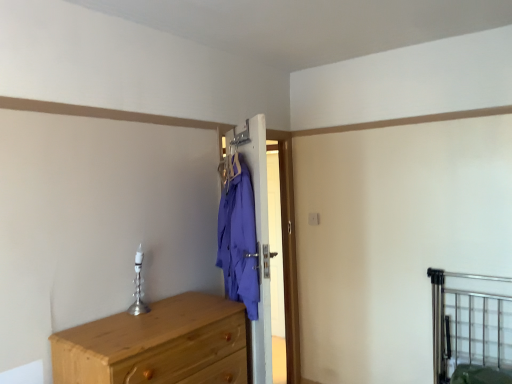
Question: Does metallic silver bed frame at lower right have a lesser width compared to light brown wooden chest of drawers at lower left?

Choices:
 (A) no
 (B) yes

Answer: (B)

Question: Can you confirm if metallic silver bed frame at lower right is taller than light brown wooden chest of drawers at lower left?

Choices:
 (A) no
 (B) yes

Answer: (B)

Question: Is metallic silver bed frame at lower right smaller than light brown wooden chest of drawers at lower left?

Choices:
 (A) yes
 (B) no

Answer: (A)

Question: From the image's perspective, is metallic silver bed frame at lower right located beneath light brown wooden chest of drawers at lower left?

Choices:
 (A) yes
 (B) no

Answer: (A)

Question: From the image's perspective, is metallic silver bed frame at lower right above light brown wooden chest of drawers at lower left?

Choices:
 (A) yes
 (B) no

Answer: (B)

Question: From a real-world perspective, is metallic silver bed frame at lower right on light brown wooden chest of drawers at lower left?

Choices:
 (A) yes
 (B) no

Answer: (B)

Question: Considering the relative sizes of light brown wooden chest of drawers at lower left and metallic silver bed frame at lower right in the image provided, is light brown wooden chest of drawers at lower left smaller than metallic silver bed frame at lower right?

Choices:
 (A) yes
 (B) no

Answer: (B)

Question: Is light brown wooden chest of drawers at lower left thinner than metallic silver bed frame at lower right?

Choices:
 (A) yes
 (B) no

Answer: (B)

Question: From a real-world perspective, does light brown wooden chest of drawers at lower left sit lower than metallic silver bed frame at lower right?

Choices:
 (A) yes
 (B) no

Answer: (B)

Question: Is light brown wooden chest of drawers at lower left turned away from metallic silver bed frame at lower right?

Choices:
 (A) yes
 (B) no

Answer: (B)

Question: From the image's perspective, is light brown wooden chest of drawers at lower left beneath metallic silver bed frame at lower right?

Choices:
 (A) yes
 (B) no

Answer: (B)

Question: Are light brown wooden chest of drawers at lower left and metallic silver bed frame at lower right beside each other?

Choices:
 (A) no
 (B) yes

Answer: (A)

Question: Considering their positions, is metallic silver bed frame at lower right located in front of or behind light brown wooden chest of drawers at lower left?

Choices:
 (A) front
 (B) behind

Answer: (B)